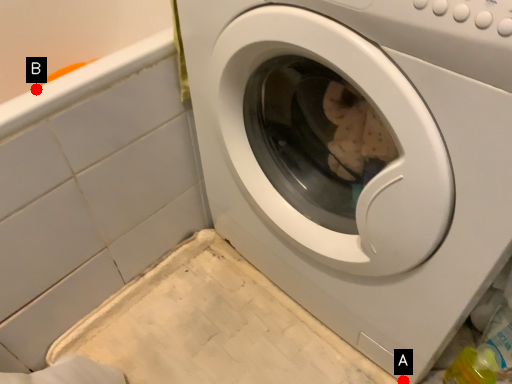
Question: Two points are circled on the image, labeled by A and B beside each circle. Which point is further to the camera?

Choices:
 (A) A is further
 (B) B is further

Answer: (A)